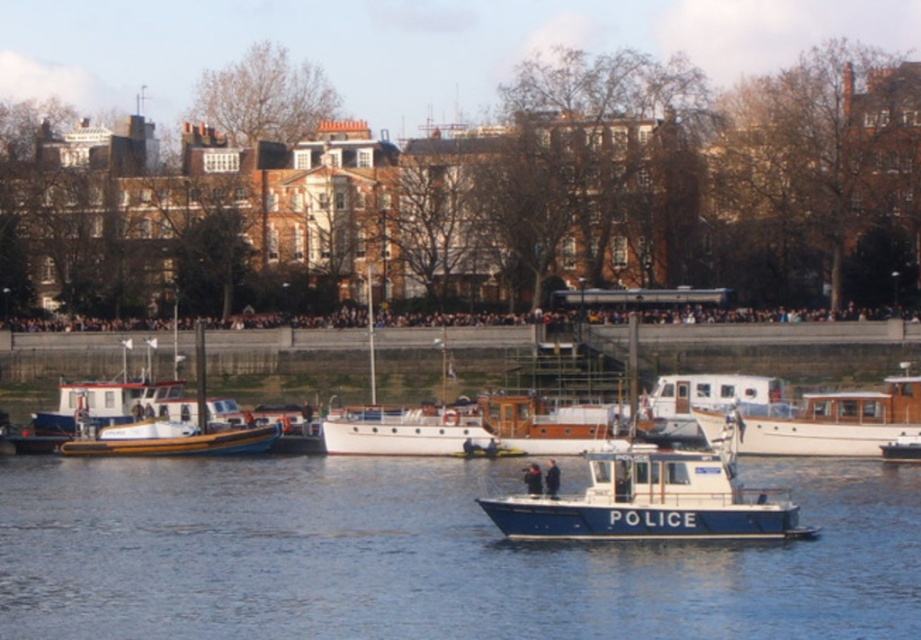
Question: Is blue polished wood police boat at center behind wooden polished cabin cruiser at center?

Choices:
 (A) no
 (B) yes

Answer: (A)

Question: Based on their relative distances, which object is nearer to the wooden polished cabin cruiser at center?

Choices:
 (A) blue polished wood police boat at center
 (B) blue polished water at center
 (C) white matte cabin cruiser at center
 (D) white polished wood boat at center

Answer: (C)

Question: Is wooden polished cabin cruiser at center closer to camera compared to white matte cabin cruiser at center?

Choices:
 (A) no
 (B) yes

Answer: (B)

Question: Which point is closer to the camera?

Choices:
 (A) (214, 528)
 (B) (475, 410)
 (C) (609, 538)

Answer: (C)

Question: Does blue polished wood police boat at center appear over white matte cabin cruiser at center?

Choices:
 (A) yes
 (B) no

Answer: (B)

Question: Considering the real-world distances, which object is farthest from the white matte cabin cruiser at center?

Choices:
 (A) wooden polished cabin cruiser at center
 (B) blue polished wood police boat at center
 (C) white polished wood boat at center

Answer: (B)